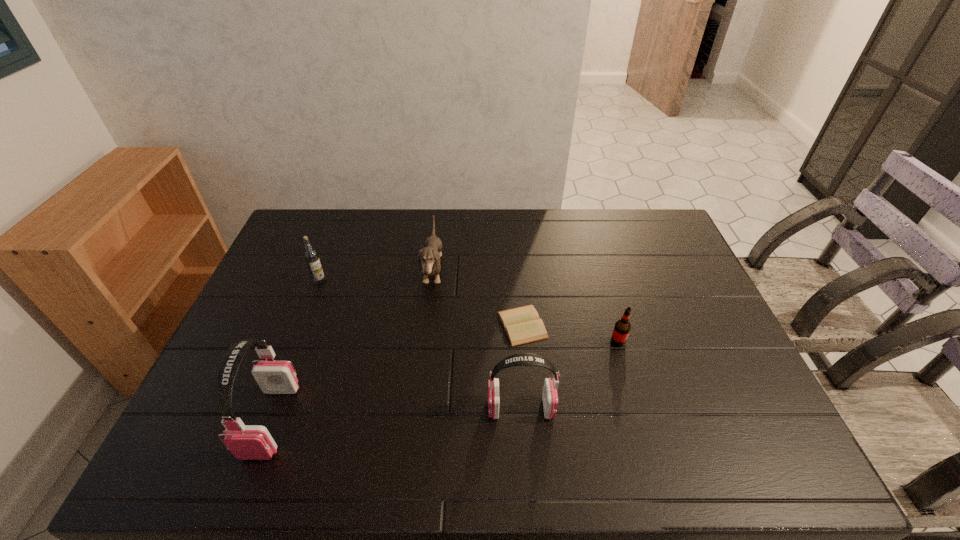
I want to click on blank space located 0.340m at the face of the puppy, so click(x=547, y=272).

What are the coordinates of `vacant space located 0.140m on the front of the root beer` in the screenshot? It's located at (633, 392).

Find the location of a particular element. The image size is (960, 540). vacant space located on the back of the shortest object is located at coordinates (516, 266).

The height and width of the screenshot is (540, 960). Find the location of `blank space located 0.350m on the label of the vodka`. blank space located 0.350m on the label of the vodka is located at coordinates (282, 379).

The width and height of the screenshot is (960, 540). Identify the location of object present at the far edge. (430, 255).

Where is `earphone present at the left edge`? This screenshot has height=540, width=960. earphone present at the left edge is located at coordinates (246, 442).

Find the location of a particular element. The image size is (960, 540). vodka that is at the left edge is located at coordinates (311, 256).

The height and width of the screenshot is (540, 960). Find the location of `object that is at the near left corner`. object that is at the near left corner is located at coordinates (246, 442).

In the image, there is a desktop. Where is `vacant space at the far edge`? This screenshot has height=540, width=960. vacant space at the far edge is located at coordinates (374, 219).

The image size is (960, 540). I want to click on vacant region at the left edge of the desktop, so click(290, 316).